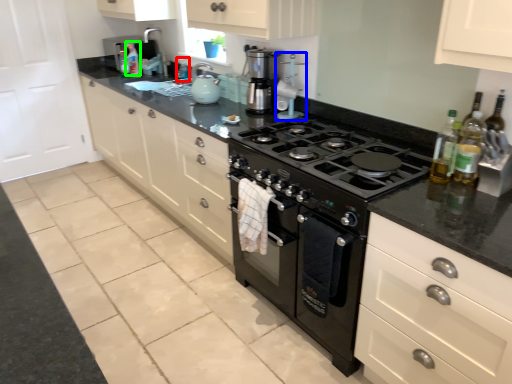
Question: Estimate the real-world distances between objects in this image. Which object is closer to bottle (highlighted by a red box), appliance (highlighted by a blue box) or bottle (highlighted by a green box)?

Choices:
 (A) appliance
 (B) bottle

Answer: (B)